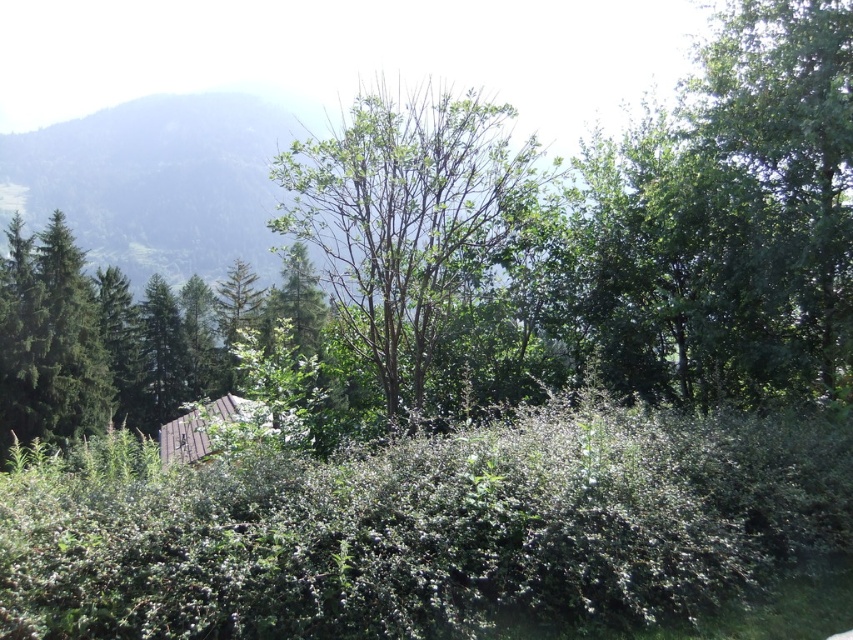
You are standing in the garden and see the green leafy hedge at center and the green leafy tree at center. Which one is positioned to the right of the other?

The green leafy hedge at center is positioned to the right of the green leafy tree at center.

You are a landscape architect designing a garden path that needs to pass between the green leafy hedge at center and the green leafy tree at center. Given that the path must be at least 1 meter wide to accommodate a wheelchair, can the space between them accommodate this requirement?

The green leafy hedge at center is smaller than the green leafy tree at center, but the description does not provide specific measurements of the distance between them. Therefore, it is impossible to determine if the space between them is wide enough for a 1 meter path without additional information.

You are standing in the middle of the garden and want to take a photo of both the green leafy hedge at center and the green leafy tree at center. Which one should you focus on first if you want both to be in clear focus?

The green leafy hedge at center is not as tall as the green leafy tree at center, so you should focus on the green leafy tree at center first to ensure both are in clear focus.